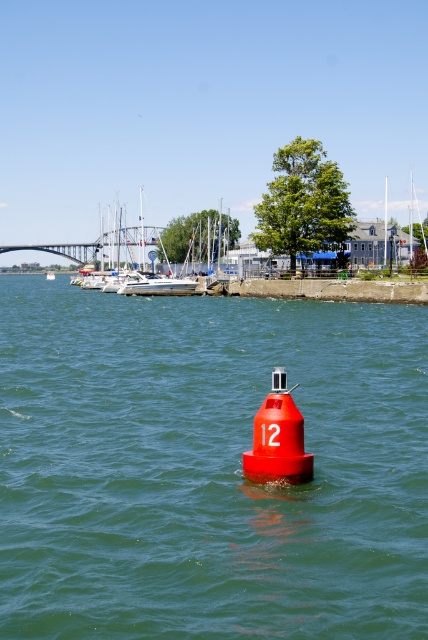
Question: Which point is farther to the camera?

Choices:
 (A) (53, 273)
 (B) (297, 493)

Answer: (A)

Question: Does smooth glossy buoy at center have a greater width compared to white plastic boat at center?

Choices:
 (A) yes
 (B) no

Answer: (A)

Question: Can you confirm if smooth glossy buoy at center is positioned below white plastic boat at center?

Choices:
 (A) yes
 (B) no

Answer: (A)

Question: Which of the following is the closest to the observer?

Choices:
 (A) smooth glossy buoy at center
 (B) white plastic boat at center

Answer: (A)

Question: Does smooth glossy buoy at center have a larger size compared to white plastic boat at center?

Choices:
 (A) yes
 (B) no

Answer: (A)

Question: Which point is farther to the camera?

Choices:
 (A) (183, 422)
 (B) (50, 280)

Answer: (B)